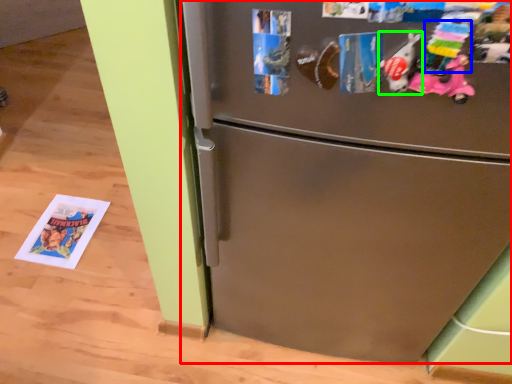
Question: Estimate the real-world distances between objects in this image. Which object is closer to refrigerator (highlighted by a red box), toy (highlighted by a blue box) or toy (highlighted by a green box)?

Choices:
 (A) toy
 (B) toy

Answer: (B)